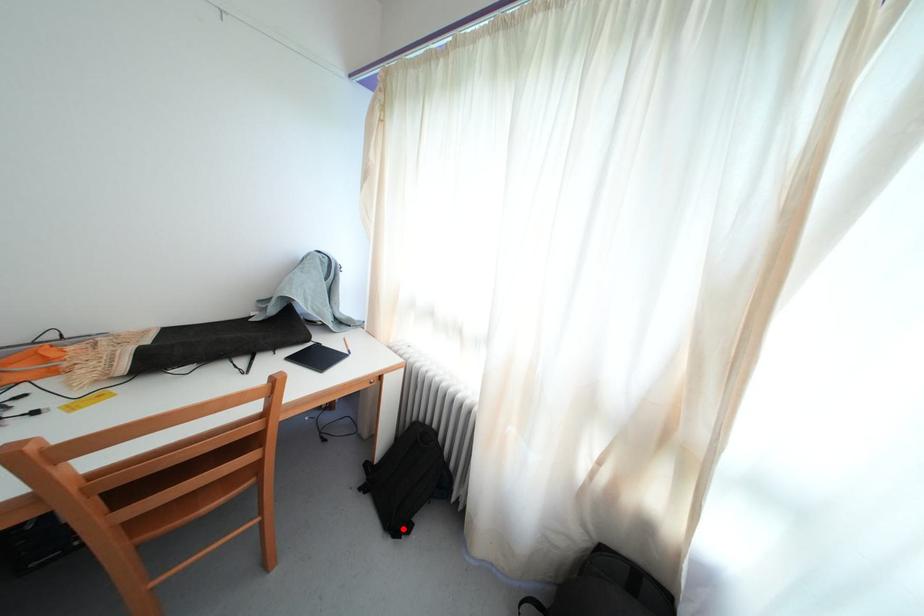
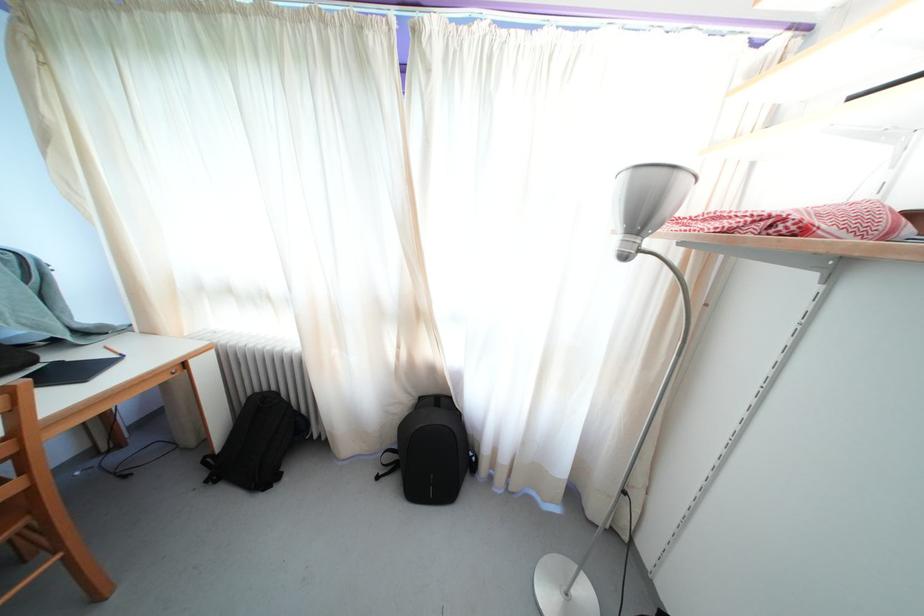
The point at the highlighted location is marked in the first image. Where is the corresponding point in the second image?

(271, 485)